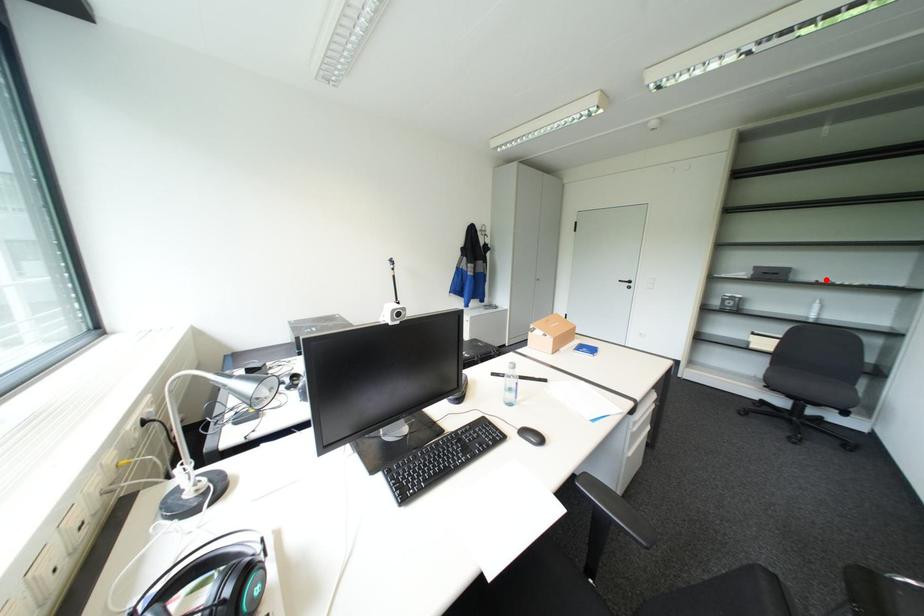
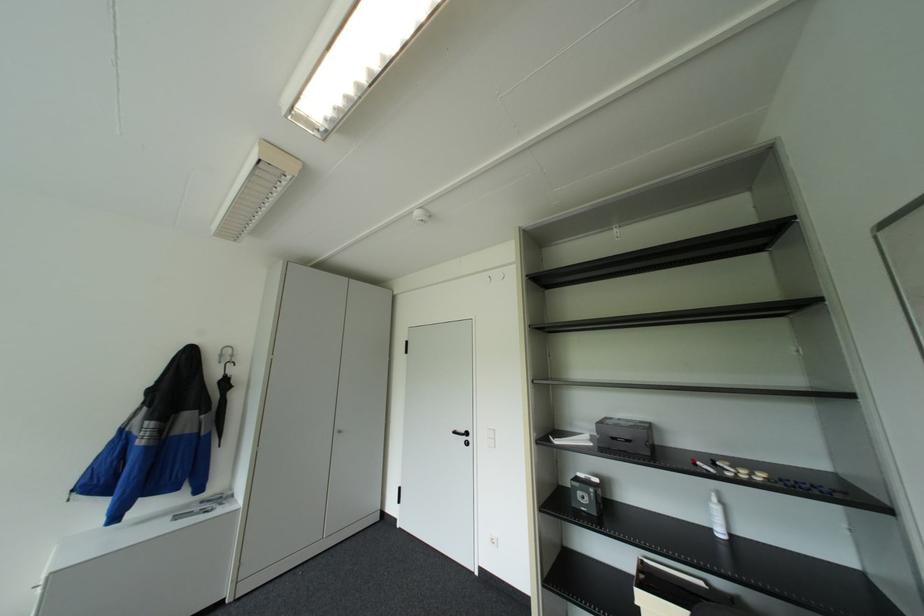
Where in the second image is the point corresponding to the highlighted location from the first image?

(702, 462)